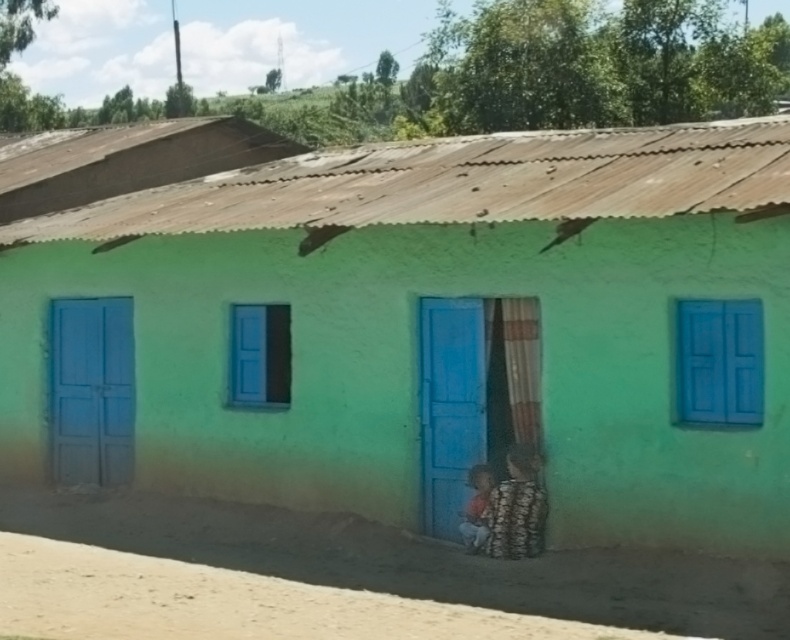
You are a delivery person trying to deliver a large package that requires a doorway width of at least 1 meter. You have to choose between the matte blue door at left and the blue matte door at center. Which door should you use?

The matte blue door at left might be wider than blue matte door at center, so it is the better choice for delivering the large package requiring at least 1 meter width.